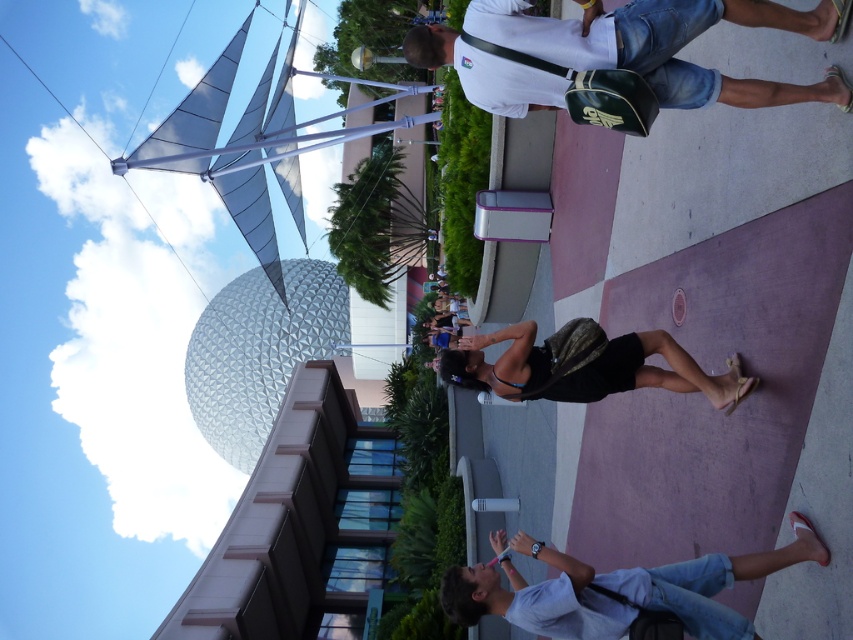
You are a photographer trying to capture a clear shot of the geodesic sphere in the background. However, there are two items blocking your view slightly. Which object, the white matte shirt at upper center or the black fabric bag at center, is closer to the camera and thus more obstructive?

The white matte shirt at upper center is positioned over the black fabric bag at center, meaning it is closer to the camera and therefore more obstructive.

You are a photographer trying to capture a clear shot of the geodesic sphere in the background. You notice two items in the foreground that might obstruct your view. Which of the two items, the white cotton shirt at lower right or the black fabric bag at center, is larger and thus more likely to block the sphere from your camera frame?

The white cotton shirt at lower right is bigger than the black fabric bag at center, so it is more likely to block the sphere from your camera frame.

You are observing two people in the scene. One is wearing a white matte shirt at upper center and the other a white cotton shirt at lower right. Which of these two shirts is wider?

The white matte shirt at upper center is wider than the white cotton shirt at lower right.